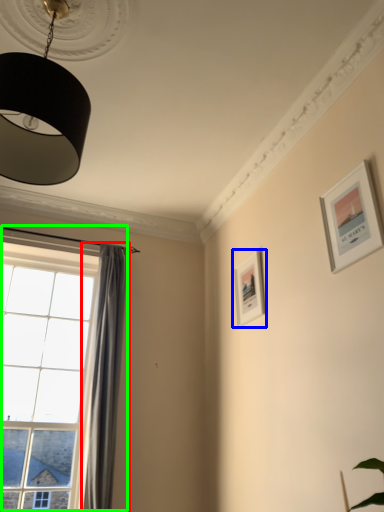
Question: Estimate the real-world distances between objects in this image. Which object is closer to curtain (highlighted by a red box), picture frame (highlighted by a blue box) or window (highlighted by a green box)?

Choices:
 (A) picture frame
 (B) window

Answer: (B)